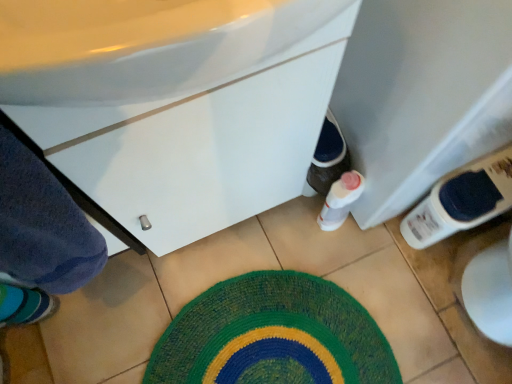
Question: Is white glossy cabinet at center turned away from knitted green bath mat at center?

Choices:
 (A) no
 (B) yes

Answer: (A)

Question: Is white glossy cabinet at center bigger than knitted green bath mat at center?

Choices:
 (A) no
 (B) yes

Answer: (B)

Question: Does white glossy cabinet at center appear on the right side of knitted green bath mat at center?

Choices:
 (A) yes
 (B) no

Answer: (B)

Question: Considering the relative sizes of white glossy cabinet at center and knitted green bath mat at center in the image provided, is white glossy cabinet at center thinner than knitted green bath mat at center?

Choices:
 (A) yes
 (B) no

Answer: (A)

Question: Can you confirm if white glossy cabinet at center is wider than knitted green bath mat at center?

Choices:
 (A) no
 (B) yes

Answer: (A)

Question: From a real-world perspective, is white plastic bottle at lower right positioned above or below white glossy cabinet at center?

Choices:
 (A) above
 (B) below

Answer: (B)

Question: Does point (435, 231) appear closer or farther from the camera than point (121, 119)?

Choices:
 (A) closer
 (B) farther

Answer: (B)

Question: Looking at their shapes, would you say white plastic bottle at lower right is wider or thinner than white glossy cabinet at center?

Choices:
 (A) wide
 (B) thin

Answer: (A)

Question: Is white plastic bottle at lower right situated inside white glossy cabinet at center or outside?

Choices:
 (A) inside
 (B) outside

Answer: (B)

Question: Considering their positions, is white glossy cabinet at center located in front of or behind knitted green bath mat at center?

Choices:
 (A) front
 (B) behind

Answer: (A)

Question: Does point (224, 92) appear closer or farther from the camera than point (231, 296)?

Choices:
 (A) closer
 (B) farther

Answer: (A)

Question: From the image's perspective, is white glossy cabinet at center located above or below knitted green bath mat at center?

Choices:
 (A) above
 (B) below

Answer: (A)

Question: From a real-world perspective, is white glossy cabinet at center physically located above or below knitted green bath mat at center?

Choices:
 (A) above
 (B) below

Answer: (A)

Question: In terms of size, does knitted green bath mat at center appear bigger or smaller than white plastic bottle at lower right?

Choices:
 (A) small
 (B) big

Answer: (A)

Question: Visually, is knitted green bath mat at center positioned to the left or to the right of white plastic bottle at lower right?

Choices:
 (A) right
 (B) left

Answer: (B)